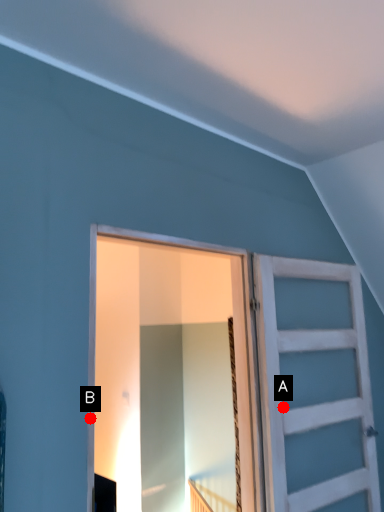
Question: Two points are circled on the image, labeled by A and B beside each circle. Which point is further to the camera?

Choices:
 (A) A is further
 (B) B is further

Answer: (A)